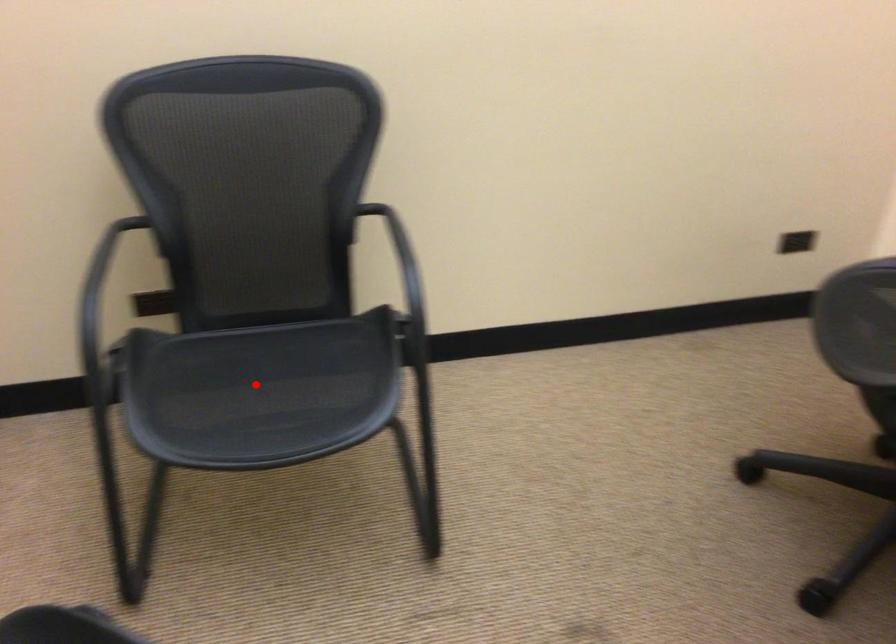
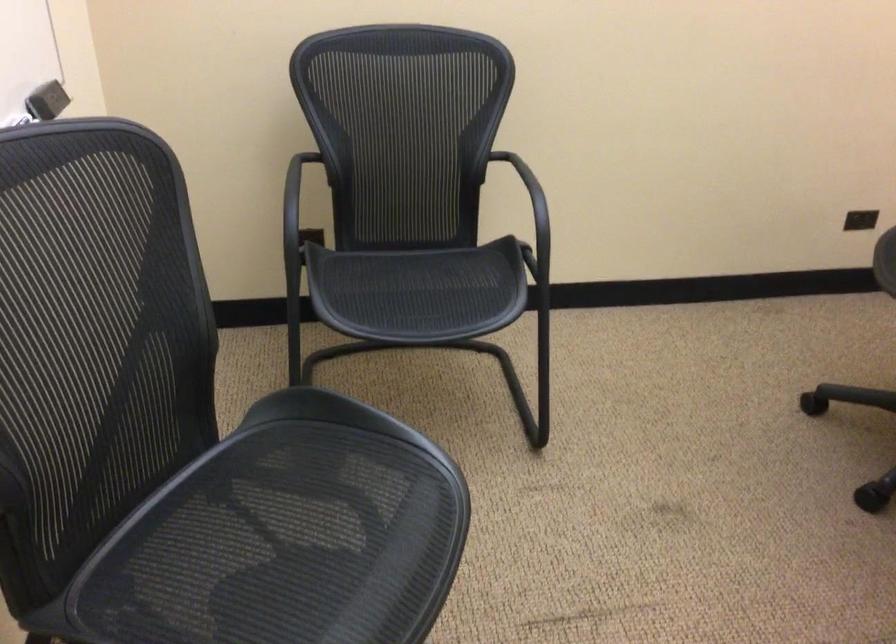
Find the pixel in the second image that matches the highlighted location in the first image.

(409, 287)